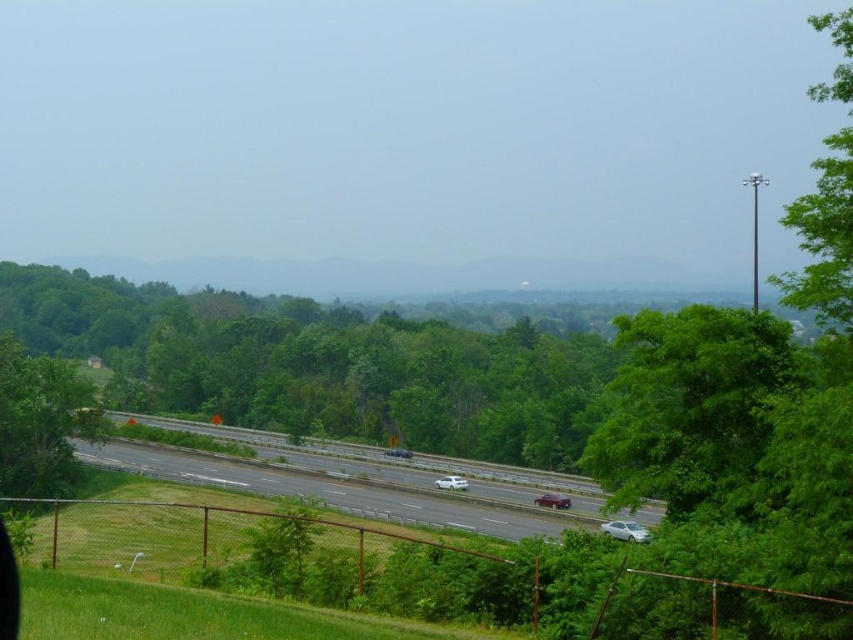
Which of these two, green leafy tree at right or green leafy tree at left, stands shorter?

With less height is green leafy tree at left.

Is point (848, 632) behind point (47, 451)?

No, it is in front of (47, 451).

You are a GUI agent. You are given a task and a screenshot of the screen. Output one action in this format:
    pyautogui.click(x=<x>, y=<y>)
    Task: Click on the green leafy tree at right
    
    Given the screenshot: What is the action you would take?
    pyautogui.click(x=747, y=416)

Based on the photo, how distant is gray asphalt highway at center from white glossy sedan at lower right?

gray asphalt highway at center and white glossy sedan at lower right are 72.00 feet apart from each other.

Is point (274, 483) positioned after point (637, 531)?

Yes.

This screenshot has height=640, width=853. In order to click on gray asphalt highway at center in this screenshot , I will do `click(351, 483)`.

Image resolution: width=853 pixels, height=640 pixels. What do you see at coordinates (351, 483) in the screenshot?
I see `gray asphalt highway at center` at bounding box center [351, 483].

Measure the distance between point (372, 493) and camera.

Point (372, 493) is 74.10 meters from camera.

What do you see at coordinates (351, 483) in the screenshot?
I see `gray asphalt highway at center` at bounding box center [351, 483].

Find the location of a particular element. gray asphalt highway at center is located at coordinates (351, 483).